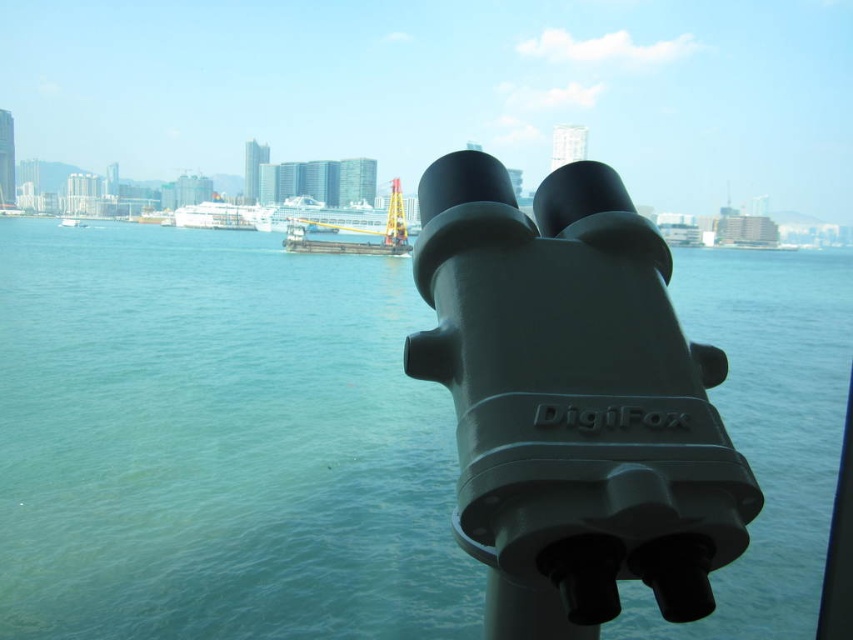
You are standing at the point marked by the coordinates point (148, 413). You want to take a photo of the cruise ship docked near the center. The camera you have can only focus on objects within 100 meters. Will the cruise ship be in focus?

The distance between point (148, 413) and the camera is 105.02 meters. Since the camera can only focus within 100 meters, the cruise ship will not be in focus.

You are a photographer trying to capture a clear shot of the cruise ship through the DigiFox binoculars. However, you notice that the matte black telescope at center and the green matte water at center are blocking your view. Which object is closer to you, making it the primary obstruction?

The green matte water at center is closer to you than the matte black telescope at center, so it is the primary obstruction blocking your view of the cruise ship.

You are a tour guide planning a boat tour. You need to ensure that the boat can pass safely between the green matte water at center and the yellow metallic crane at center. The boat requires a minimum clearance of 40 meters. Can the boat safely navigate this space?

The green matte water at center and yellow metallic crane at center are 42.80 meters apart, which exceeds the boat minimum clearance requirement of 40 meters. Therefore, the boat can safely navigate between them.